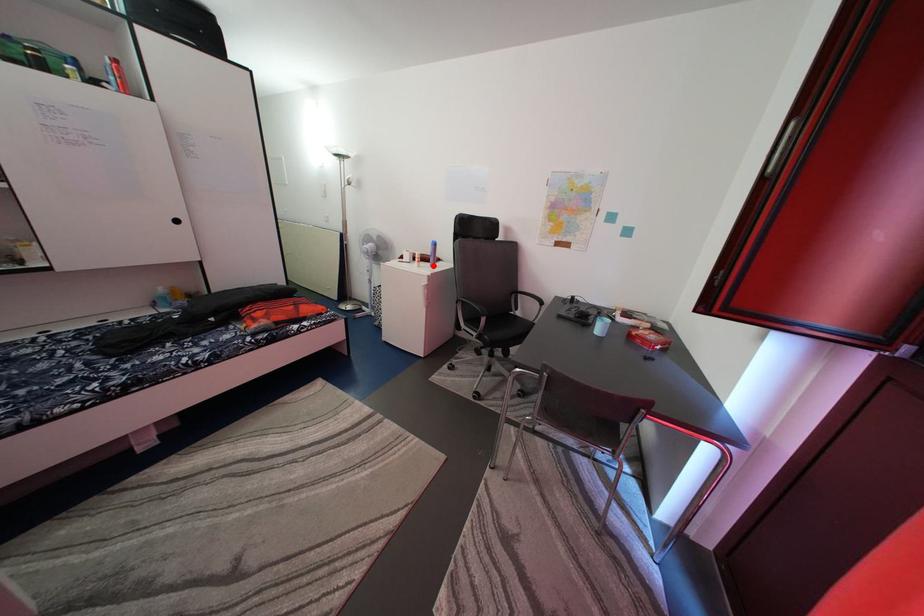
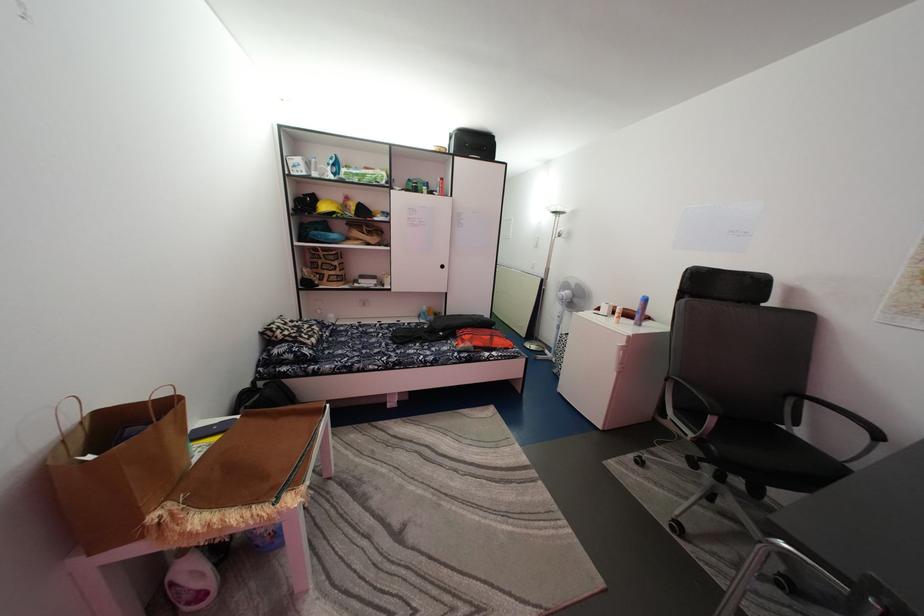
The point at the highlighted location is marked in the first image. Where is the corresponding point in the second image?

(637, 322)